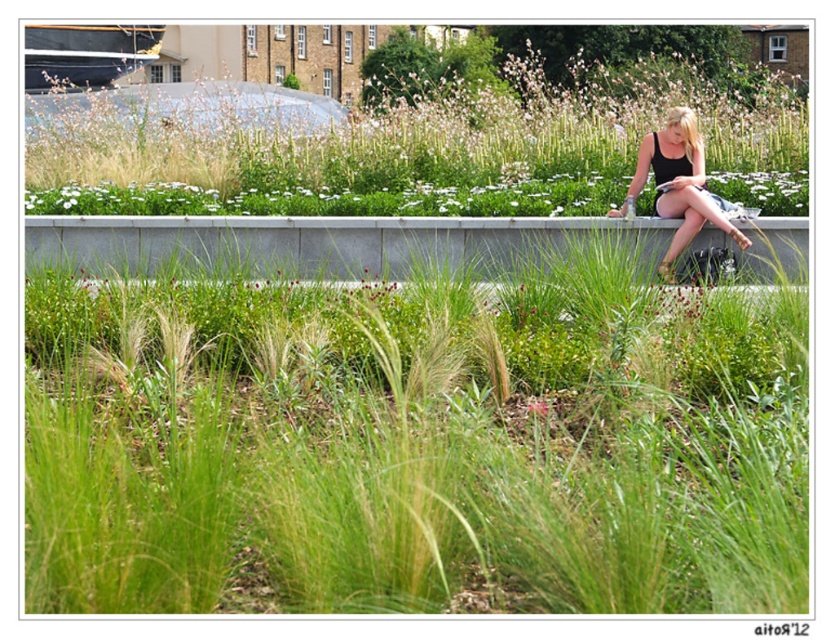
Question: Can you confirm if gray concrete ledge at upper center is bigger than black matte tank top at upper right?

Choices:
 (A) yes
 (B) no

Answer: (B)

Question: Considering the real-world distances, which object is closest to the green grass at center?

Choices:
 (A) black matte tank top at upper right
 (B) gray concrete ledge at upper center

Answer: (B)

Question: Which point is farther from the camera taking this photo?

Choices:
 (A) (631, 180)
 (B) (560, 221)
 (C) (327, 435)

Answer: (A)

Question: Which point is closer to the camera?

Choices:
 (A) gray concrete ledge at upper center
 (B) green grass at center
 (C) black matte tank top at upper right

Answer: (B)

Question: Observing the image, what is the correct spatial positioning of green grass at center in reference to gray concrete ledge at upper center?

Choices:
 (A) above
 (B) below

Answer: (B)

Question: Is green grass at center in front of black matte tank top at upper right?

Choices:
 (A) no
 (B) yes

Answer: (B)